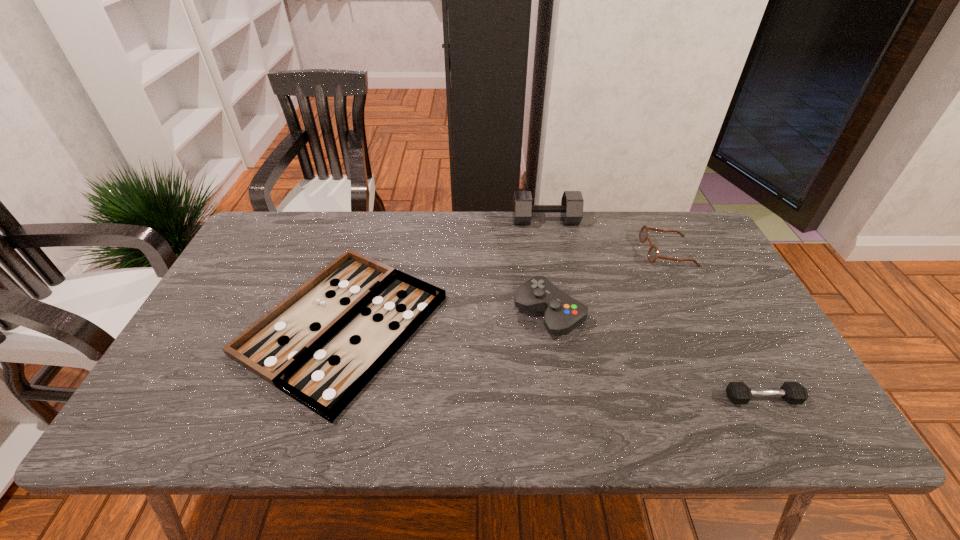
Locate an element on the screen. the farther dumbbell is located at coordinates (571, 208).

Where is `the tallest object`? The width and height of the screenshot is (960, 540). the tallest object is located at coordinates (571, 208).

At what (x,y) coordinates should I click in order to perform the action: click on the fourth shortest object. Please return your answer as a coordinate pair (x, y). Looking at the image, I should click on (562, 314).

You are a GUI agent. You are given a task and a screenshot of the screen. Output one action in this format:
    pyautogui.click(x=<x>, y=<y>)
    Task: Click on the third shortest object
    
    Given the screenshot: What is the action you would take?
    pyautogui.click(x=652, y=255)

Find the location of a particular element. the nearer dumbbell is located at coordinates (737, 392).

I want to click on the fourth tallest object, so click(737, 392).

I want to click on the shortest object, so click(321, 345).

At what (x,y) coordinates should I click in order to perform the action: click on the leftmost object. Please return your answer as a coordinate pair (x, y). This screenshot has height=540, width=960. Looking at the image, I should click on (321, 345).

Locate an element on the screen. blank area located on the right of the left dumbbell is located at coordinates (679, 220).

You are a GUI agent. You are given a task and a screenshot of the screen. Output one action in this format:
    pyautogui.click(x=<x>, y=<y>)
    Task: Click on the vacant space situated 0.180m on the front of the control
    
    Given the screenshot: What is the action you would take?
    pyautogui.click(x=564, y=405)